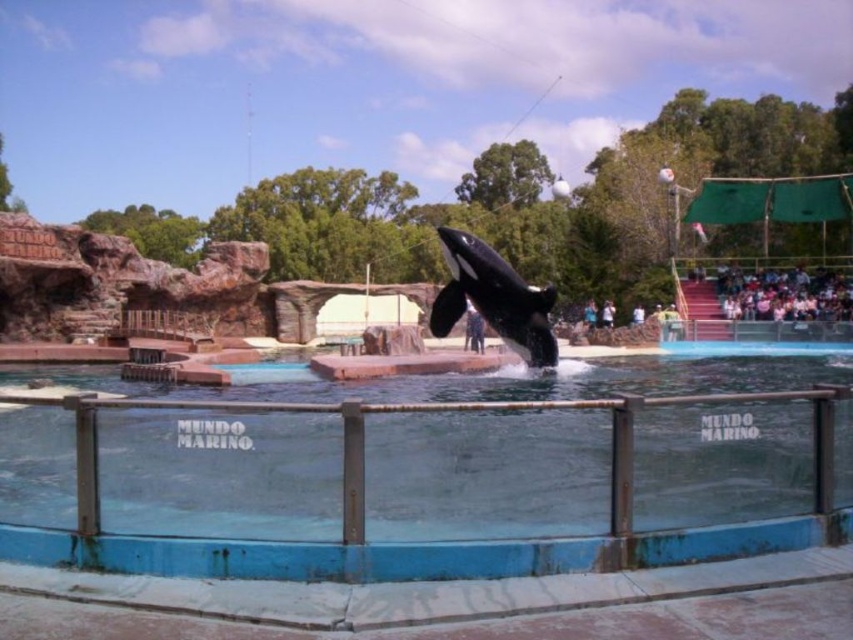
Is blue plastic pool at center below black smooth orca at center?

Indeed, blue plastic pool at center is positioned under black smooth orca at center.

This screenshot has width=853, height=640. What do you see at coordinates (364, 476) in the screenshot?
I see `blue plastic pool at center` at bounding box center [364, 476].

Is point (117, 556) in front of point (538, 301)?

Yes, point (117, 556) is closer to viewer.

Image resolution: width=853 pixels, height=640 pixels. Identify the location of blue plastic pool at center. (364, 476).